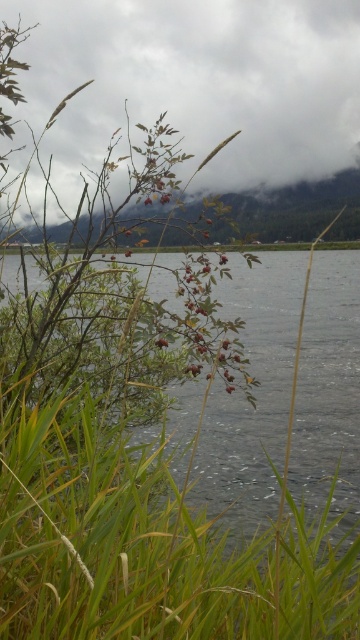
Question: Is cloudy sky at upper center smaller than smooth gray water at center?

Choices:
 (A) yes
 (B) no

Answer: (B)

Question: Among these points, which one is nearest to the camera?

Choices:
 (A) (261, 136)
 (B) (280, 358)

Answer: (B)

Question: Does cloudy sky at upper center have a smaller size compared to smooth gray water at center?

Choices:
 (A) no
 (B) yes

Answer: (A)

Question: In this image, where is cloudy sky at upper center located relative to smooth gray water at center?

Choices:
 (A) right
 (B) left

Answer: (B)